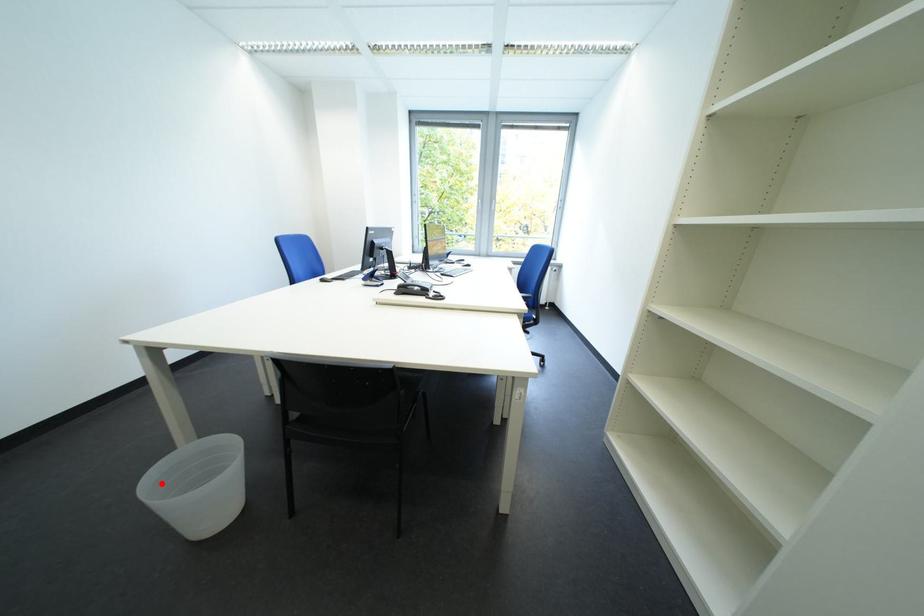
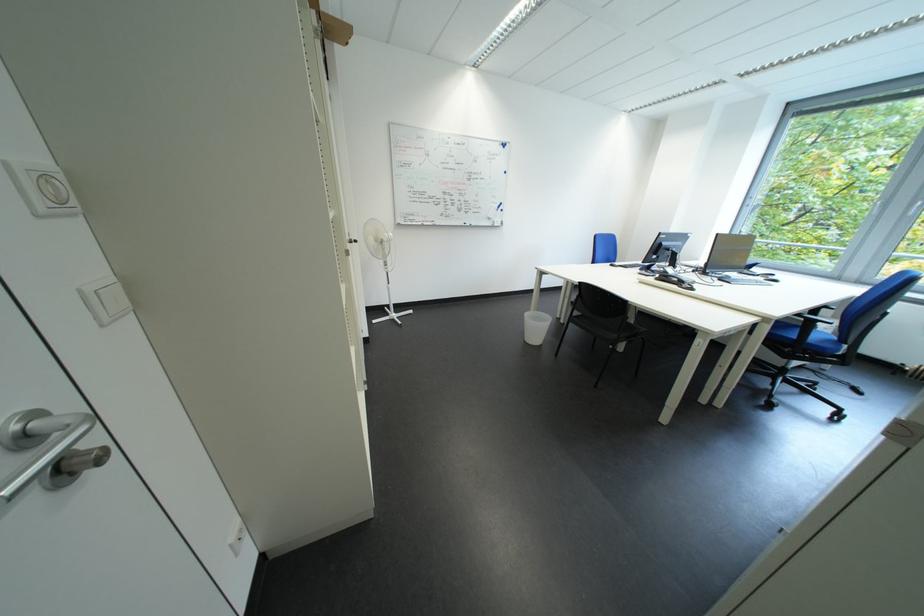
The point at the highlighted location is marked in the first image. Where is the corresponding point in the second image?

(540, 317)